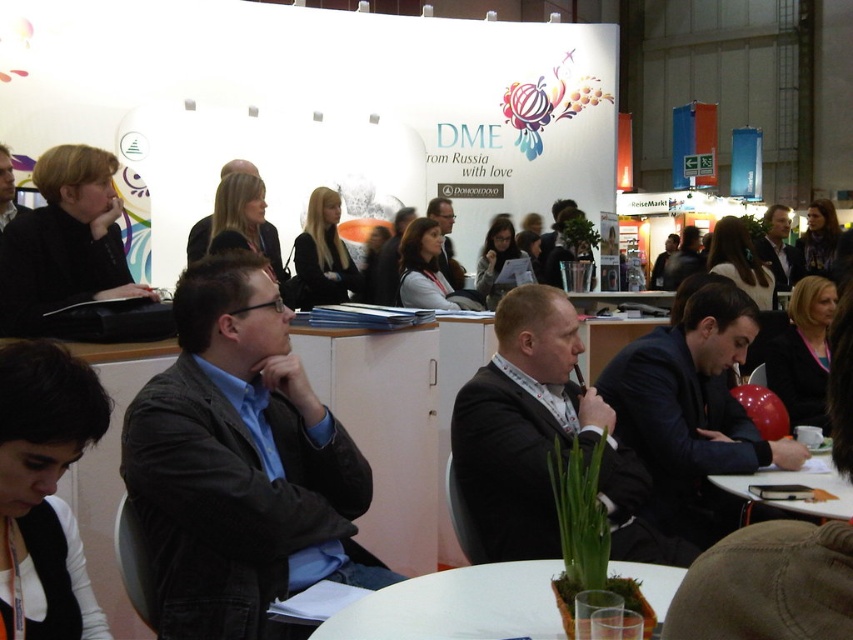
You are organizing a small meeting and need to place a white paper at lower right on a table. Which table should you choose between the white plastic table at center and another table not shown in the image?

You should choose the white plastic table at center because it is positioned on the left side of the white paper at lower right, indicating it is the correct table for placement.

You are a photographer at the event and need to capture a clear photo of both the dark gray jacket at center and the matte black jacket at center. Since you want both jackets to be visible in the photo, which jacket should you focus on first to ensure proper depth of field?

The dark gray jacket at center is much taller than the matte black jacket at center, so focusing on the taller jacket first would help ensure both are in focus as depth of field typically extends more behind the point of focus.

You are a photographer positioned at the back of the conference hall. You notice the white plastic table at center and the white paper at lower right. Which object appears taller from your vantage point?

The white paper at lower right appears taller than the white plastic table at center from your vantage point because the white plastic table at center is shorter than the white paper at lower right.